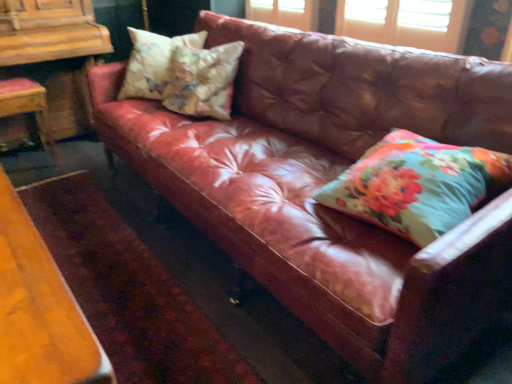
Question: Does wooden chair at left come in front of floral fabric pillow at right, placed as the third pillow when sorted from back to front?

Choices:
 (A) no
 (B) yes

Answer: (A)

Question: From a real-world perspective, is wooden chair at left on top of floral fabric pillow at right, placed as the third pillow when sorted from back to front?

Choices:
 (A) no
 (B) yes

Answer: (A)

Question: Does wooden chair at left have a greater width compared to floral fabric pillow at right, which is the first pillow from front to back?

Choices:
 (A) yes
 (B) no

Answer: (B)

Question: Can you confirm if wooden chair at left is positioned to the right of floral fabric pillow at right, which is the first pillow from front to back?

Choices:
 (A) no
 (B) yes

Answer: (A)

Question: From the image's perspective, is wooden chair at left under floral fabric pillow at right, placed as the third pillow when sorted from back to front?

Choices:
 (A) yes
 (B) no

Answer: (B)

Question: Considering their positions, is floral fabric cushion at upper left, which ranks as the 2th pillow in left-to-right order, located in front of or behind wooden dresser at left?

Choices:
 (A) front
 (B) behind

Answer: (A)

Question: Based on their sizes in the image, would you say floral fabric cushion at upper left, placed as the second pillow when sorted from back to front, is bigger or smaller than wooden dresser at left?

Choices:
 (A) small
 (B) big

Answer: (A)

Question: In terms of width, does floral fabric cushion at upper left, the 2th pillow positioned from the right, look wider or thinner when compared to wooden dresser at left?

Choices:
 (A) thin
 (B) wide

Answer: (A)

Question: From the image's perspective, is floral fabric cushion at upper left, placed as the second pillow when sorted from back to front, located above or below wooden dresser at left?

Choices:
 (A) above
 (B) below

Answer: (B)

Question: From the image's perspective, is floral fabric pillow at upper left, the first pillow when ordered from back to front, above or below floral fabric cushion at upper left, the 2th pillow positioned from the right?

Choices:
 (A) above
 (B) below

Answer: (A)

Question: Is point (124, 87) closer or farther from the camera than point (180, 77)?

Choices:
 (A) closer
 (B) farther

Answer: (B)

Question: Is floral fabric pillow at upper left, positioned as the third pillow in front-to-back order, inside or outside of floral fabric cushion at upper left, which is the second pillow from front to back?

Choices:
 (A) outside
 (B) inside

Answer: (A)

Question: In terms of size, does floral fabric pillow at upper left, the first pillow when ordered from back to front, appear bigger or smaller than floral fabric cushion at upper left, which ranks as the 2th pillow in left-to-right order?

Choices:
 (A) small
 (B) big

Answer: (B)

Question: Do you think floral fabric pillow at upper left, positioned as the third pillow in front-to-back order, is within wooden chair at left, or outside of it?

Choices:
 (A) inside
 (B) outside

Answer: (B)

Question: Based on their sizes in the image, would you say floral fabric pillow at upper left, acting as the first pillow starting from the left, is bigger or smaller than wooden chair at left?

Choices:
 (A) big
 (B) small

Answer: (B)